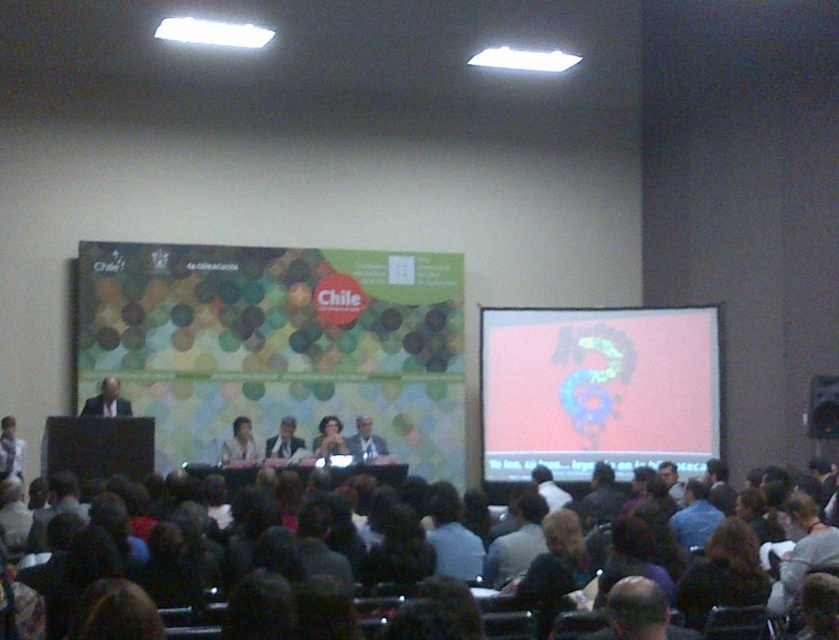
Which of these two, pink matte projection screen at upper right or matte black dress at center, stands taller?

pink matte projection screen at upper right is taller.

Where is `pink matte projection screen at upper right`? The height and width of the screenshot is (640, 839). pink matte projection screen at upper right is located at coordinates (597, 388).

Find the location of a particular element. This screenshot has height=640, width=839. pink matte projection screen at upper right is located at coordinates (597, 388).

Is point (440, 509) farther from viewer compared to point (288, 442)?

No, it is in front of (288, 442).

Between point (456, 556) and point (287, 417), which one is positioned behind?

The point (287, 417) is behind.

Is point (428, 525) in front of point (292, 449)?

Yes, it is in front of point (292, 449).

This screenshot has width=839, height=640. I want to click on dark gray shirt at lower center, so click(451, 536).

The height and width of the screenshot is (640, 839). What are the coordinates of `dark hair at lower center` in the screenshot? It's located at (242, 580).

Based on the photo, can you confirm if dark hair at lower center is taller than dark brown hair at lower right?

No, dark hair at lower center is not taller than dark brown hair at lower right.

Identify the location of dark hair at lower center. The width and height of the screenshot is (839, 640). (242, 580).

In order to click on dark hair at lower center in this screenshot , I will do `click(242, 580)`.